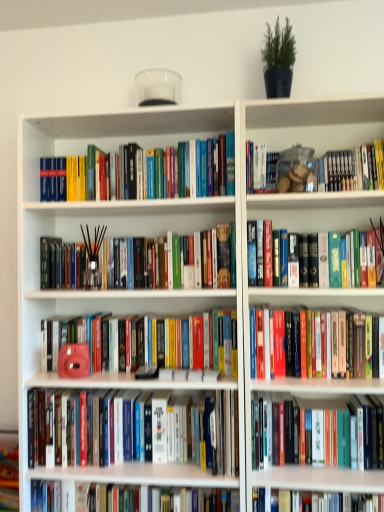
What do you see at coordinates (369, 255) in the screenshot? The height and width of the screenshot is (512, 384). I see `hardcover book at center, marked as the 7th book in a bottom-to-top arrangement` at bounding box center [369, 255].

Locate an element on the screen. hardcover book at center, the seventh book in the top-to-bottom sequence is located at coordinates (329, 433).

Locate an element on the screen. white glossy book at center, which is the first book in bottom-to-top order is located at coordinates (210, 500).

What do you see at coordinates (210, 500) in the screenshot? The width and height of the screenshot is (384, 512). I see `white glossy book at center, which is the first book in bottom-to-top order` at bounding box center [210, 500].

Locate an element on the screen. The width and height of the screenshot is (384, 512). hardcover book at center, the second book in the top-to-bottom sequence is located at coordinates (369, 255).

Is the position of matte pink camera at center, which is counted as the 3th book, starting from the bottom, more distant than that of hardcover book at center, marked as the 7th book in a bottom-to-top arrangement?

Yes.

From the image's perspective, between matte pink camera at center, which is counted as the 3th book, starting from the bottom, and hardcover book at center, marked as the 7th book in a bottom-to-top arrangement, who is located below?

matte pink camera at center, which is counted as the 3th book, starting from the bottom, appears lower in the image.

The image size is (384, 512). I want to click on the 4th book below the hardcover book at center, marked as the 7th book in a bottom-to-top arrangement (from the image's perspective), so click(x=208, y=432).

Based on the photo, would you say matte pink camera at center, acting as the 6th book starting from the top, is outside hardcover book at center, marked as the 7th book in a bottom-to-top arrangement?

Absolutely, matte pink camera at center, acting as the 6th book starting from the top, is external to hardcover book at center, marked as the 7th book in a bottom-to-top arrangement.

From the image's perspective, between matte pink camera at center, acting as the 6th book starting from the top, and hardcover books at center, the fourth book when ordered from top to bottom, which one is located above?

hardcover books at center, the fourth book when ordered from top to bottom, from the image's perspective.

From a real-world perspective, is matte pink camera at center, which is counted as the 3th book, starting from the bottom, over hardcover books at center, the fourth book when ordered from top to bottom?

No.

Is matte pink camera at center, which is counted as the 3th book, starting from the bottom, positioned far away from hardcover books at center, the fourth book when ordered from top to bottom?

They are positioned close to each other.

At what (x,y) coordinates should I click in order to perform the action: click on the 3rd book counting from the left of the matte pink camera at center, the 5th book viewed from the top. Please return your answer as a coordinate pair (x, y). Looking at the image, I should click on (160, 172).

Consider the image. Is matte pink camera at center, the 5th book viewed from the top, directly adjacent to hardcover books at upper left, the 8th book when ordered from bottom to top?

matte pink camera at center, the 5th book viewed from the top, is not next to hardcover books at upper left, the 8th book when ordered from bottom to top, and they're not touching.

From the image's perspective, between matte pink camera at center, the 5th book viewed from the top, and hardcover books at upper left, the 8th book when ordered from bottom to top, which one is located above?

hardcover books at upper left, the 8th book when ordered from bottom to top.

Looking at the image, does matte pink camera at center, which is the 4th book in bottom-to-top order, seem bigger or smaller compared to hardcover books at upper left, the 8th book when ordered from bottom to top?

Considering their sizes, matte pink camera at center, which is the 4th book in bottom-to-top order, takes up more space than hardcover books at upper left, the 8th book when ordered from bottom to top.

Could you tell me if hardcover books at center, the fourth book when ordered from top to bottom, is turned towards matte pink camera at center, which is counted as the 3th book, starting from the bottom?

No, hardcover books at center, the fourth book when ordered from top to bottom, is not aimed at matte pink camera at center, which is counted as the 3th book, starting from the bottom.

Can you confirm if hardcover books at center, the fourth book when ordered from top to bottom, is taller than matte pink camera at center, which is counted as the 3th book, starting from the bottom?

No, hardcover books at center, the fourth book when ordered from top to bottom, is not taller than matte pink camera at center, which is counted as the 3th book, starting from the bottom.

Which point is more distant from viewer, (331, 317) or (199, 412)?

The point (199, 412) is behind.

Consider the image. Considering the positions of objects hardcover books at center, the fourth book when ordered from top to bottom, and matte pink camera at center, acting as the 6th book starting from the top, in the image provided, who is in front, hardcover books at center, the fourth book when ordered from top to bottom, or matte pink camera at center, acting as the 6th book starting from the top,?

hardcover books at center, the fourth book when ordered from top to bottom, is more forward.

Does hardcover books at upper left, the 1th book positioned from the top, touch matte pink camera at center, which is the 4th book in bottom-to-top order?

No, hardcover books at upper left, the 1th book positioned from the top, is not making contact with matte pink camera at center, which is the 4th book in bottom-to-top order.

Can you confirm if hardcover books at upper left, the 8th book when ordered from bottom to top, is positioned to the left of matte pink camera at center, which is the 4th book in bottom-to-top order?

Yes.

Which object is further away from the camera taking this photo, hardcover books at upper left, the 1th book positioned from the top, or matte pink camera at center, the 5th book viewed from the top?

hardcover books at upper left, the 1th book positioned from the top, is further from the camera.

Is hardcover books at upper left, the 8th book when ordered from bottom to top, facing towards matte pink camera at center, the 5th book viewed from the top?

No, hardcover books at upper left, the 8th book when ordered from bottom to top, is not facing towards matte pink camera at center, the 5th book viewed from the top.

Locate an element on the screen. book that is the 1st one when counting backward from the hardcover book at center, marked as the 7th book in a bottom-to-top arrangement is located at coordinates (332, 345).

Is the surface of hardcover books at center, the fourth book when ordered from top to bottom, in direct contact with hardcover book at center, marked as the 7th book in a bottom-to-top arrangement?

No, hardcover books at center, the fourth book when ordered from top to bottom, is not beside hardcover book at center, marked as the 7th book in a bottom-to-top arrangement.

Considering the sizes of objects hardcover books at center, which ranks as the 5th book in bottom-to-top order, and hardcover book at center, marked as the 7th book in a bottom-to-top arrangement, in the image provided, who is taller, hardcover books at center, which ranks as the 5th book in bottom-to-top order, or hardcover book at center, marked as the 7th book in a bottom-to-top arrangement,?

hardcover book at center, marked as the 7th book in a bottom-to-top arrangement.

Looking at their sizes, would you say white glossy book at center, which is the 8th book in top-to-bottom order, is wider or thinner than hardcover books at upper left, the 8th book when ordered from bottom to top?

In the image, white glossy book at center, which is the 8th book in top-to-bottom order, appears to be wider than hardcover books at upper left, the 8th book when ordered from bottom to top.

From the image's perspective, which is above, white glossy book at center, which is the 8th book in top-to-bottom order, or hardcover books at upper left, the 1th book positioned from the top?

hardcover books at upper left, the 1th book positioned from the top.

Considering the points (159, 498) and (137, 189), which point is in front, point (159, 498) or point (137, 189)?

The point (137, 189) is closer.

At what (x,y) coordinates should I click in order to perform the action: click on the 2nd book counting from the right of the matte pink camera at center, acting as the 6th book starting from the top. Please return your answer as a coordinate pair (x, y). Looking at the image, I should click on (369, 255).

You are a GUI agent. You are given a task and a screenshot of the screen. Output one action in this format:
    pyautogui.click(x=<x>, y=<y>)
    Task: Click on the 2nd book above the matte pink camera at center, acting as the 6th book starting from the top (from the image's perspective)
    The width and height of the screenshot is (384, 512).
    Given the screenshot: What is the action you would take?
    pyautogui.click(x=332, y=345)

Considering their positions, is black matte incense sticks at center, acting as the 6th book starting from the bottom, positioned further to matte pink camera at center, which is the 4th book in bottom-to-top order, than white glossy book at center, which is the 8th book in top-to-bottom order?

Based on the image, white glossy book at center, which is the 8th book in top-to-bottom order, appears to be further to matte pink camera at center, which is the 4th book in bottom-to-top order.

When comparing their distances from hardcover book at center, marked as the 7th book in a bottom-to-top arrangement, does white glossy book at center, which is the first book in bottom-to-top order, or matte pink camera at center, acting as the 6th book starting from the top, seem further?

Among the two, white glossy book at center, which is the first book in bottom-to-top order, is located further to hardcover book at center, marked as the 7th book in a bottom-to-top arrangement.

From the image, which object appears to be farther from hardcover book at center, marked as the 7th book in a bottom-to-top arrangement, matte pink camera at center, which is counted as the 3th book, starting from the bottom, or black matte incense sticks at center, the 3th book when ordered from top to bottom?

matte pink camera at center, which is counted as the 3th book, starting from the bottom, is positioned further to the anchor hardcover book at center, marked as the 7th book in a bottom-to-top arrangement.

Based on their spatial positions, is white glossy book at center, which is the first book in bottom-to-top order, or hardcover books at upper left, the 1th book positioned from the top, closer to black matte incense sticks at center, the 3th book when ordered from top to bottom?

hardcover books at upper left, the 1th book positioned from the top, is closer to black matte incense sticks at center, the 3th book when ordered from top to bottom.

When comparing their distances from black matte incense sticks at center, acting as the 6th book starting from the bottom, does white glossy book at center, which is the first book in bottom-to-top order, or matte pink camera at center, the 5th book viewed from the top, seem further?

Among the two, white glossy book at center, which is the first book in bottom-to-top order, is located further to black matte incense sticks at center, acting as the 6th book starting from the bottom.

Looking at the image, which one is located closer to matte pink camera at center, acting as the 6th book starting from the top, white glossy book at center, which is the first book in bottom-to-top order, or matte pink camera at center, the 5th book viewed from the top?

Based on the image, white glossy book at center, which is the first book in bottom-to-top order, appears to be nearer to matte pink camera at center, acting as the 6th book starting from the top.

Looking at this image, when comparing their distances from hardcover books at center, the fourth book when ordered from top to bottom, does matte pink camera at center, which is the 4th book in bottom-to-top order, or hardcover book at center, marked as the 7th book in a bottom-to-top arrangement, seem closer?

hardcover book at center, marked as the 7th book in a bottom-to-top arrangement.

Based on their spatial positions, is hardcover book at center, the seventh book in the top-to-bottom sequence, or hardcover books at center, which ranks as the 5th book in bottom-to-top order, further from hardcover book at center, the second book in the top-to-bottom sequence?

hardcover book at center, the seventh book in the top-to-bottom sequence, is positioned further to the anchor hardcover book at center, the second book in the top-to-bottom sequence.

I want to click on book located between matte pink camera at center, which is counted as the 3th book, starting from the bottom, and hardcover book at center, marked as the 7th book in a bottom-to-top arrangement, in the left-right direction, so click(332, 345).

At what (x,y) coordinates should I click in order to perform the action: click on book located between matte pink camera at center, which is the 4th book in bottom-to-top order, and hardcover books at center, the fourth book when ordered from top to bottom, in the left-right direction. Please return your answer as a coordinate pair (x, y). This screenshot has width=384, height=512. Looking at the image, I should click on (208, 432).